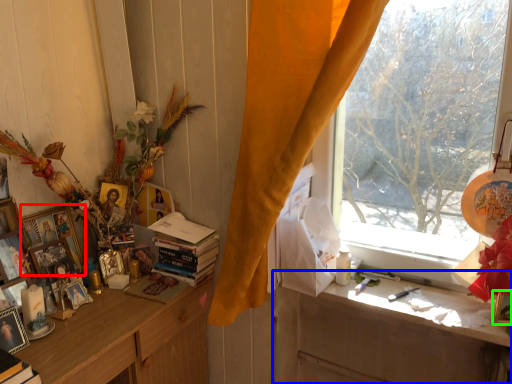
Question: Which object is the farthest from picture frame (highlighted by a red box)? Choose among these: desk (highlighted by a blue box) or picture frame (highlighted by a green box).

Choices:
 (A) desk
 (B) picture frame

Answer: (B)